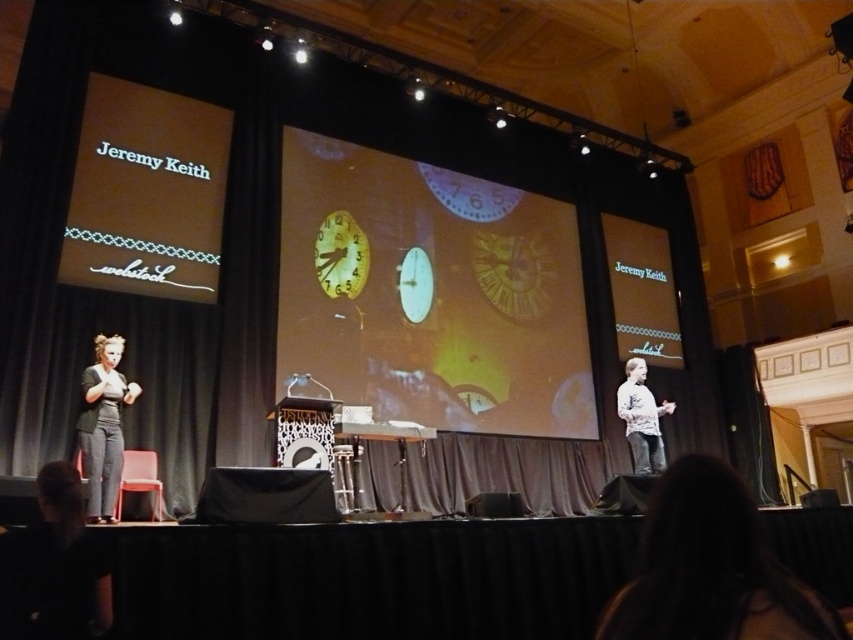
This screenshot has height=640, width=853. I want to click on translucent glass clock at center, so click(430, 292).

Based on the photo, how distant is translucent glass clock at center from white textured shirt at center?

8.11 feet

Image resolution: width=853 pixels, height=640 pixels. In order to click on translucent glass clock at center in this screenshot , I will do `click(430, 292)`.

Does dark hair at lower right appear under white textured shirt at center?

Incorrect, dark hair at lower right is not positioned below white textured shirt at center.

Which is more to the left, dark hair at lower right or white textured shirt at center?

dark hair at lower right is more to the left.

Is point (666, 554) more distant than point (621, 388)?

No, (666, 554) is closer to viewer.

You are a GUI agent. You are given a task and a screenshot of the screen. Output one action in this format:
    pyautogui.click(x=<x>, y=<y>)
    Task: Click on the dark hair at lower right
    The height and width of the screenshot is (640, 853).
    Given the screenshot: What is the action you would take?
    pyautogui.click(x=711, y=568)

Between dark hair at lower right and dark gray textured pants at left, which one appears on the left side from the viewer's perspective?

Positioned to the left is dark gray textured pants at left.

Can you confirm if dark hair at lower right is thinner than dark gray textured pants at left?

Indeed, dark hair at lower right has a lesser width compared to dark gray textured pants at left.

Locate an element on the screen. The image size is (853, 640). dark hair at lower right is located at coordinates (711, 568).

The height and width of the screenshot is (640, 853). In order to click on dark hair at lower right in this screenshot , I will do `click(711, 568)`.